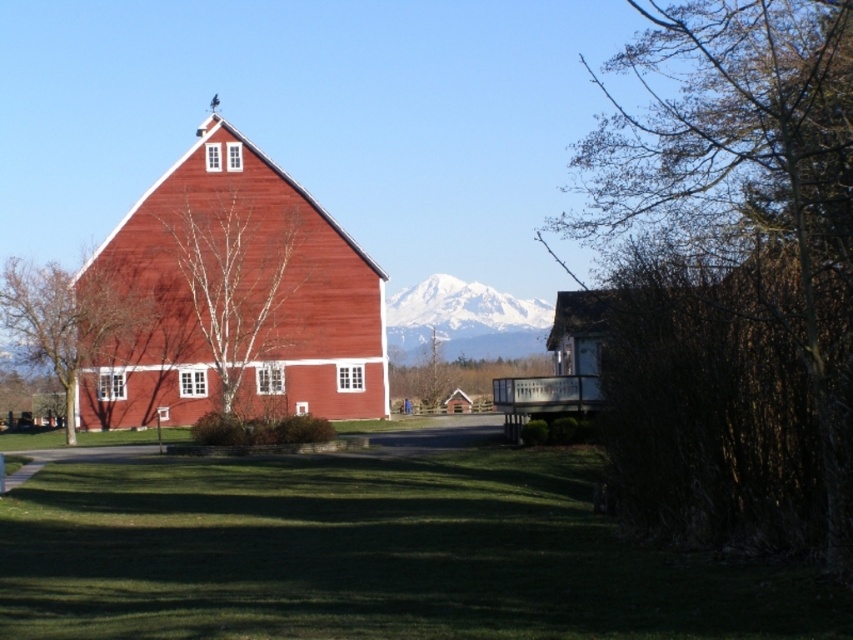
You are a painter standing at the edge of the driveway. You want to paint the matte wood barn at center and the bare branches at left in your painting. Which object should you focus on first to capture their full height in your painting?

The matte wood barn at center is much taller than the bare branches at left, so you should focus on capturing the full height of the matte wood barn at center first.

You are an artist planning to paint the rural scene. You want to ensure the bare branches at upper right and the snowy peak at center are proportionally accurate. Which object should you draw larger in your painting?

The bare branches at upper right should be drawn larger than the snowy peak at center because the description states that the bare branches at upper right is bigger than snowy peak at center.

You are standing in the middle of the driveway and see the bare birch tree at center and the snowy peak at center. Which object is closer to your left side?

The bare birch tree at center is positioned on the left side of snowy peak at center, so it is closer to your left side.